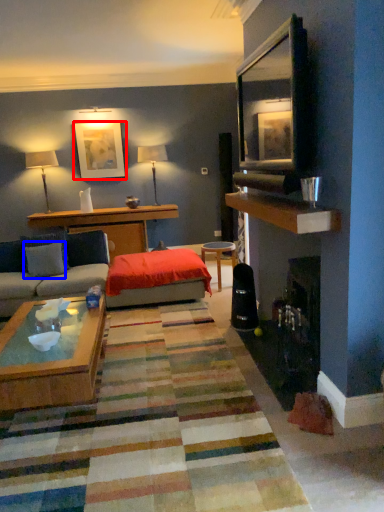
Question: Which point is further to the camera, picture frame (highlighted by a red box) or pillow (highlighted by a blue box)?

Choices:
 (A) picture frame
 (B) pillow

Answer: (A)